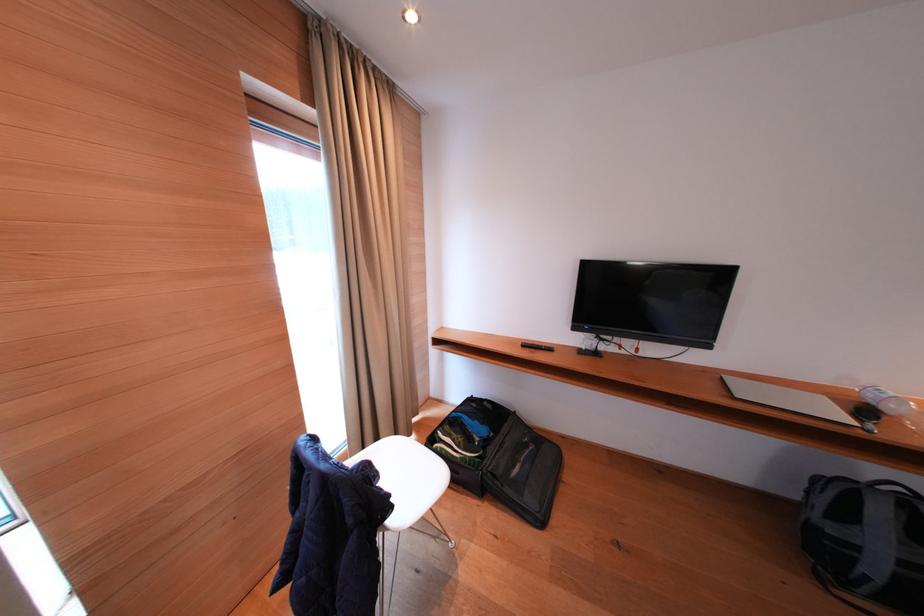
Find the location of a particular element. plastic water bottle is located at coordinates (892, 405).